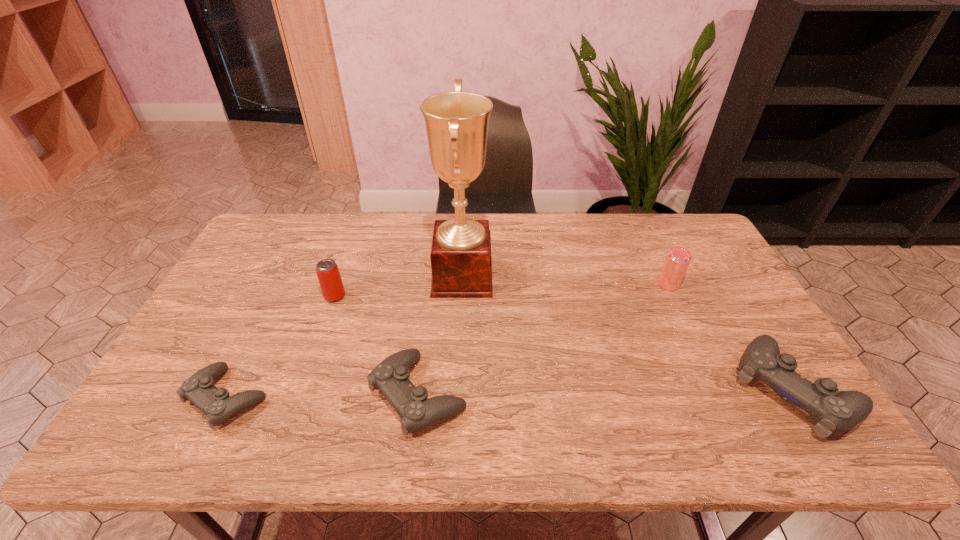
In the image, there is a desktop. Where is `vacant space at the far edge`? vacant space at the far edge is located at coordinates (356, 248).

Find the location of a particular element. The height and width of the screenshot is (540, 960). blank space at the left edge is located at coordinates (174, 370).

You are a GUI agent. You are given a task and a screenshot of the screen. Output one action in this format:
    pyautogui.click(x=<x>, y=<y>)
    Task: Click on the vacant space at the far right corner
    
    Given the screenshot: What is the action you would take?
    pos(691,230)

Find the location of a particular element. This screenshot has height=540, width=960. vacant area at the near right corner of the desktop is located at coordinates pyautogui.click(x=749, y=395).

Locate an element on the screen. The height and width of the screenshot is (540, 960). vacant point located between the second object from left to right and the right beer can is located at coordinates (502, 290).

The width and height of the screenshot is (960, 540). In order to click on blank region between the second object from left to right and the second shortest control in this screenshot , I will do `click(376, 345)`.

Locate an element on the screen. The width and height of the screenshot is (960, 540). free spot between the rightmost object and the tallest object is located at coordinates (628, 333).

This screenshot has height=540, width=960. Identify the location of vacant space in between the fifth tallest object and the tallest object. click(x=441, y=336).

The image size is (960, 540). In order to click on vacant space in between the second object from right to left and the tallest object in this screenshot , I will do `click(565, 280)`.

At what (x,y) coordinates should I click in order to perform the action: click on unoccupied area between the second tallest control and the right beer can. Please return your answer as a coordinate pair (x, y). The image size is (960, 540). Looking at the image, I should click on (543, 339).